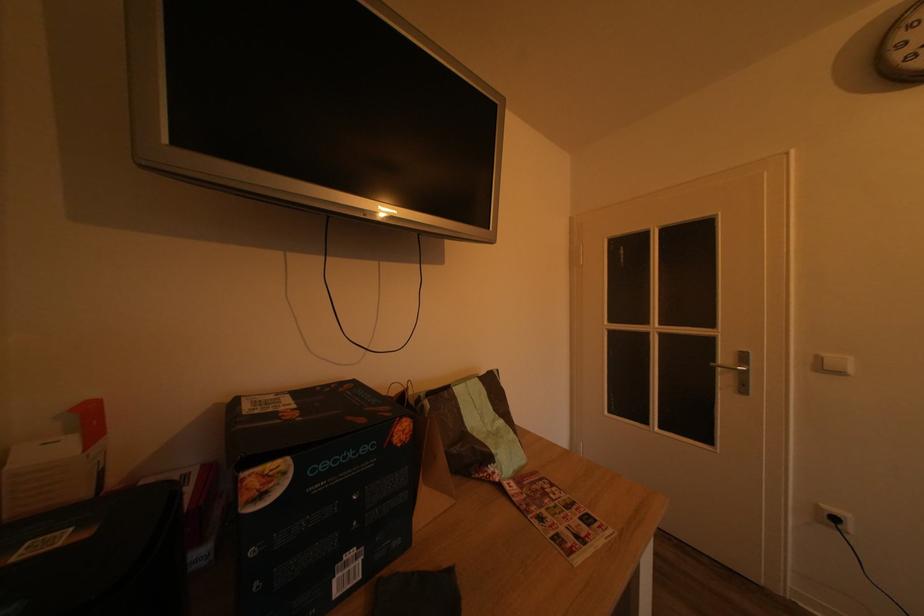
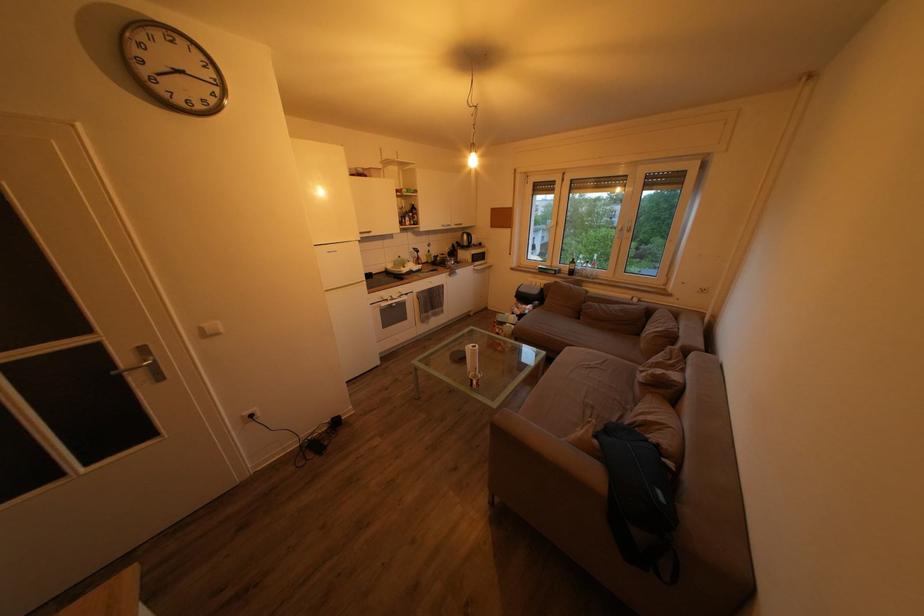
The point at (832, 361) is marked in the first image. Where is the corresponding point in the second image?

(211, 331)